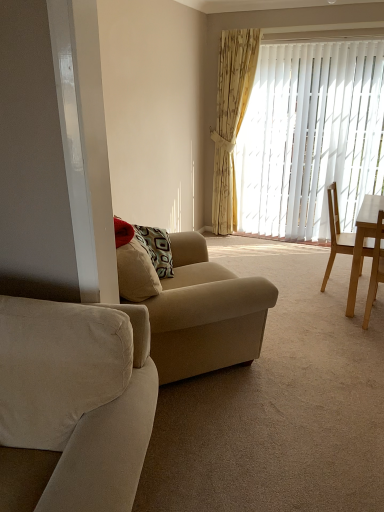
Question: Would you say light brown wooden chair at right, which is the first chair in front-to-back order, is to the left or to the right of yellow floral fabric curtain at upper right in the picture?

Choices:
 (A) right
 (B) left

Answer: (A)

Question: Is light brown wooden chair at right, which is the first chair in front-to-back order, wider or thinner than yellow floral fabric curtain at upper right?

Choices:
 (A) thin
 (B) wide

Answer: (B)

Question: Which object is the farthest from the suede beige couch at left, which is the 2th studio couch from back to front?

Choices:
 (A) light brown wooden chair at right, placed as the 2th chair when sorted from front to back
 (B) beige fabric couch at center, acting as the first studio couch starting from the back
 (C) white vertical blinds at center
 (D) yellow floral fabric curtain at upper right
 (E) light wood desk at right

Answer: (D)

Question: Which is farther from the beige fabric couch at center, acting as the first studio couch starting from the back?

Choices:
 (A) yellow floral fabric curtain at upper right
 (B) suede beige couch at left, positioned as the 1th studio couch in front-to-back order
 (C) light wood desk at right
 (D) white vertical blinds at center
 (E) light brown wooden chair at right, acting as the 2th chair starting from the back

Answer: (A)